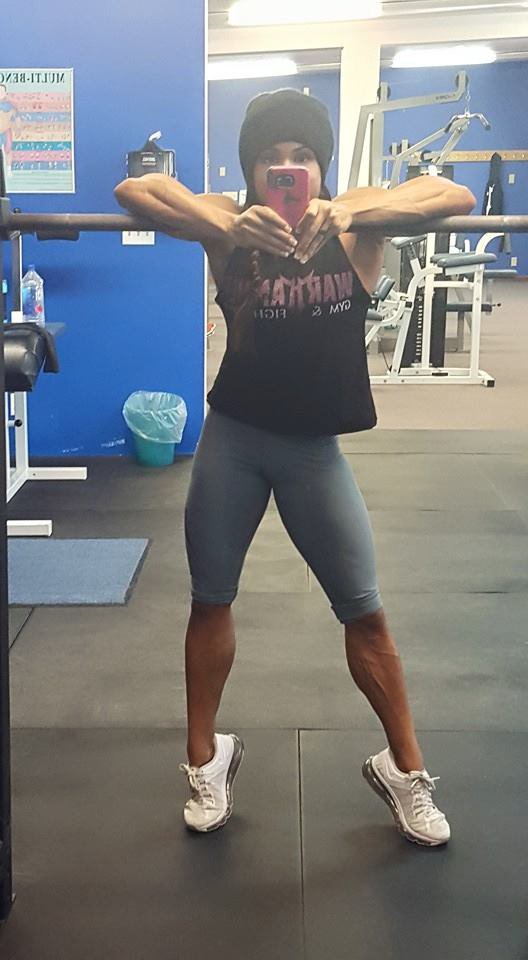
The width and height of the screenshot is (528, 960). In order to click on trash can with plastic bag in this screenshot , I will do `click(155, 419)`.